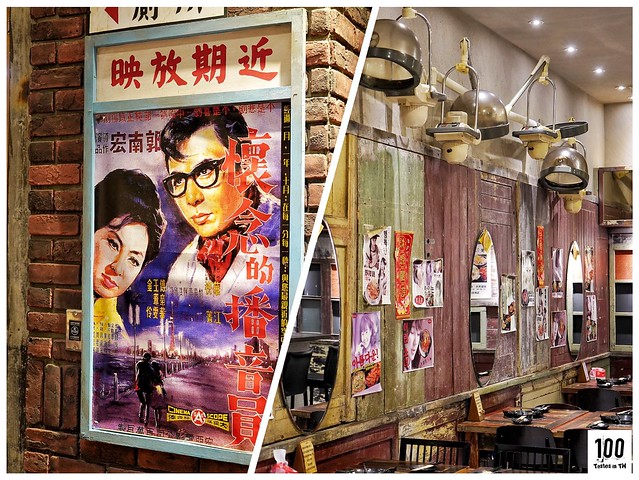
Locate an element on the screen. The width and height of the screenshot is (639, 480). 10 posters on this side of the wall is located at coordinates [419, 380], [433, 304], [385, 277], [365, 362], [548, 327], [535, 282], [511, 318], [560, 267], [560, 330], [594, 282].